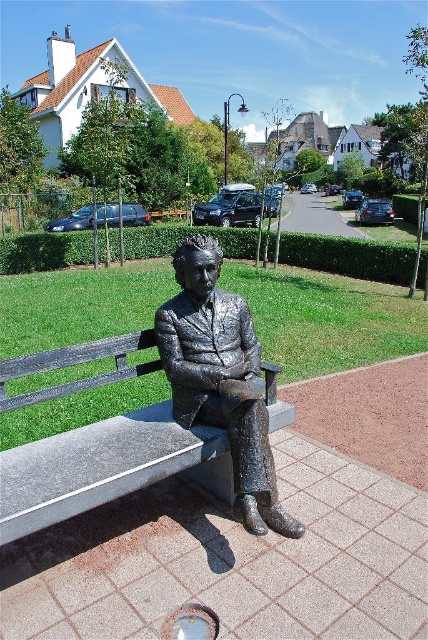
Question: Which point is closer to the camera taking this photo?

Choices:
 (A) (187, 445)
 (B) (208, 273)

Answer: (A)

Question: Is smooth gray bench at center above shiny bronze statue at center?

Choices:
 (A) no
 (B) yes

Answer: (A)

Question: Can you confirm if smooth gray bench at center is bigger than shiny bronze statue at center?

Choices:
 (A) no
 (B) yes

Answer: (B)

Question: Which of the following is the closest to the observer?

Choices:
 (A) (130, 452)
 (B) (228, 353)

Answer: (A)

Question: Does smooth gray bench at center have a lesser width compared to shiny bronze statue at center?

Choices:
 (A) no
 (B) yes

Answer: (A)

Question: Which point is farther to the camera?

Choices:
 (A) (74, 392)
 (B) (262, 433)

Answer: (A)